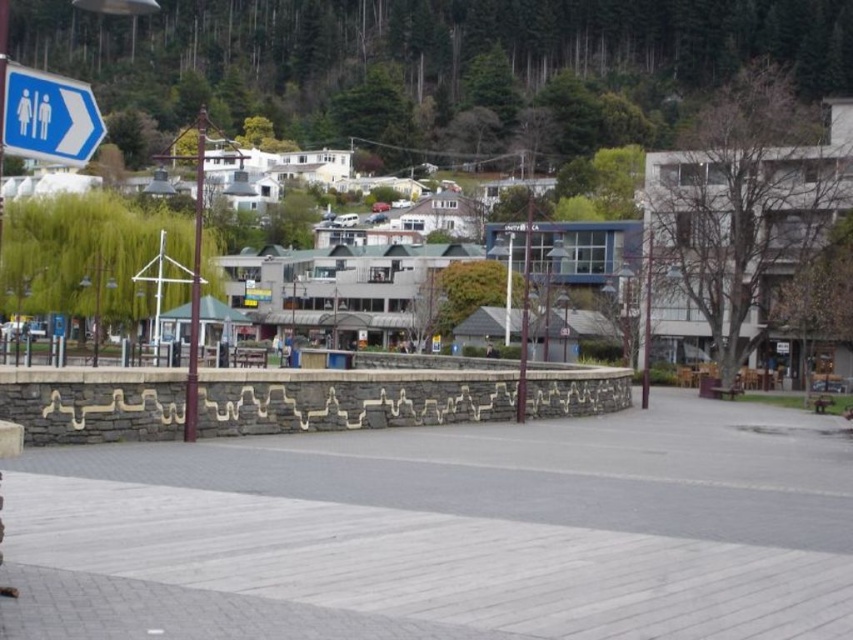
You are a pedestrian standing at the edge of the gray concrete pavement at center. You want to look up to see the blue plastic sign at upper left. In which direction should you look?

The gray concrete pavement at center is below the blue plastic sign at upper left, so you should look upward to see the blue plastic sign at upper left.

You are a delivery person trying to navigate through the plaza. You see the gray concrete pavement at center and the blue plastic sign at upper left. Which object is wider?

The gray concrete pavement at center is wider than the blue plastic sign at upper left according to the description.